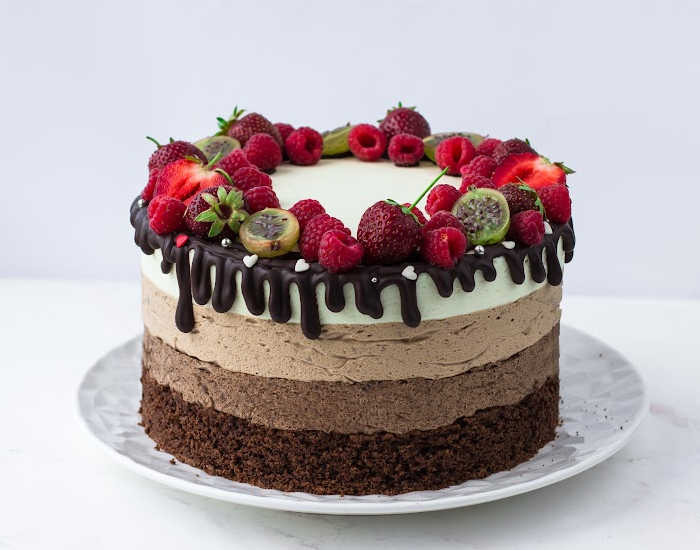
You are a GUI agent. You are given a task and a screenshot of the screen. Output one action in this format:
    pyautogui.click(x=<x>, y=<y>)
    Task: Click on the plate
    The image size is (700, 550).
    Given the screenshot: What is the action you would take?
    pyautogui.click(x=245, y=497)